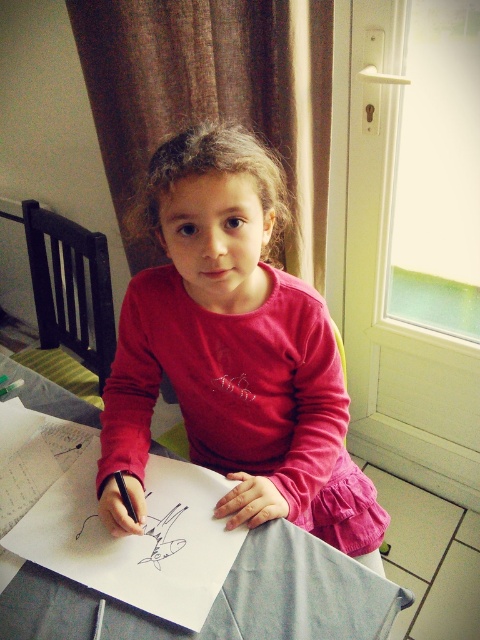
Question: Among these points, which one is farthest from the camera?

Choices:
 (A) (122, 502)
 (B) (278, 528)
 (C) (245, 355)

Answer: (C)

Question: Which is farther from the white paper at center?

Choices:
 (A) pink fabric shirt at center
 (B) black matte pencil at lower left

Answer: (A)

Question: Is white paper at center further to camera compared to black matte pencil at lower left?

Choices:
 (A) no
 (B) yes

Answer: (A)

Question: Can you confirm if pink fabric shirt at center is positioned above black matte pencil at lower left?

Choices:
 (A) no
 (B) yes

Answer: (B)

Question: Which of the following is the farthest from the observer?

Choices:
 (A) (124, 488)
 (B) (33, 380)

Answer: (B)

Question: From the image, what is the correct spatial relationship of white paper at center in relation to black matte pencil at lower left?

Choices:
 (A) below
 (B) above

Answer: (A)